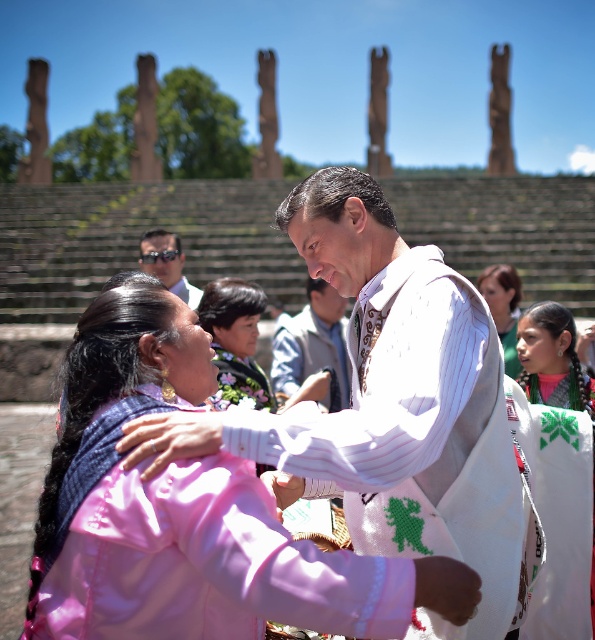
Which is more to the left, light gray fabric shirt at center or matte green dress at center?

light gray fabric shirt at center is more to the left.

Can you confirm if light gray fabric shirt at center is thinner than matte green dress at center?

Yes, light gray fabric shirt at center is thinner than matte green dress at center.

Locate an element on the screen. light gray fabric shirt at center is located at coordinates (311, 342).

Where is `light gray fabric shirt at center`? light gray fabric shirt at center is located at coordinates (311, 342).

Who is taller, white striped sweater at center or matte green dress at center?

Standing taller between the two is white striped sweater at center.

Is white striped sweater at center to the left of matte green dress at center from the viewer's perspective?

Correct, you'll find white striped sweater at center to the left of matte green dress at center.

The width and height of the screenshot is (595, 640). What are the coordinates of `white striped sweater at center` in the screenshot? It's located at (415, 436).

Is white embroidered blouse at center shorter than multicolored braided hair at center?

In fact, white embroidered blouse at center may be taller than multicolored braided hair at center.

Is white embroidered blouse at center above multicolored braided hair at center?

Incorrect, white embroidered blouse at center is not positioned above multicolored braided hair at center.

The image size is (595, 640). Describe the element at coordinates (555, 374) in the screenshot. I see `white embroidered blouse at center` at that location.

Where is `white embroidered blouse at center`? The width and height of the screenshot is (595, 640). white embroidered blouse at center is located at coordinates point(555,374).